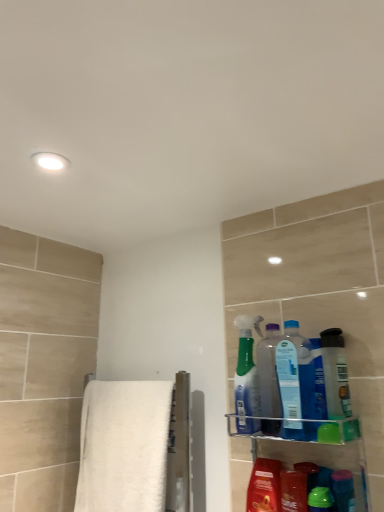
Question: Can you confirm if translucent green spray bottle at upper right, the fifth cleaning product viewed from the right, is bigger than translucent plastic spray bottle at upper right, acting as the 5th cleaning product starting from the left?

Choices:
 (A) yes
 (B) no

Answer: (A)

Question: Would you say translucent green spray bottle at upper right, the fifth cleaning product viewed from the right, is a long distance from translucent plastic spray bottle at upper right, positioned as the first cleaning product in right-to-left order?

Choices:
 (A) yes
 (B) no

Answer: (B)

Question: From the image's perspective, does translucent green spray bottle at upper right, the fifth cleaning product viewed from the right, appear lower than translucent plastic spray bottle at upper right, acting as the 5th cleaning product starting from the left?

Choices:
 (A) yes
 (B) no

Answer: (A)

Question: Would you say translucent green spray bottle at upper right, the 1th cleaning product viewed from the left, is outside translucent plastic spray bottle at upper right, acting as the 5th cleaning product starting from the left?

Choices:
 (A) no
 (B) yes

Answer: (B)

Question: From a real-world perspective, is translucent green spray bottle at upper right, the fifth cleaning product viewed from the right, beneath translucent plastic spray bottle at upper right, acting as the 5th cleaning product starting from the left?

Choices:
 (A) no
 (B) yes

Answer: (A)

Question: Does translucent green spray bottle at upper right, the 1th cleaning product viewed from the left, have a lesser width compared to translucent plastic spray bottle at upper right, acting as the 5th cleaning product starting from the left?

Choices:
 (A) yes
 (B) no

Answer: (B)

Question: Is shiny plastic mouthwash at lower right placed right next to clear plastic shelf at lower right?

Choices:
 (A) no
 (B) yes

Answer: (B)

Question: From a real-world perspective, is shiny plastic mouthwash at lower right on clear plastic shelf at lower right?

Choices:
 (A) yes
 (B) no

Answer: (B)

Question: Is shiny plastic mouthwash at lower right facing away from clear plastic shelf at lower right?

Choices:
 (A) no
 (B) yes

Answer: (B)

Question: Is shiny plastic mouthwash at lower right at the right side of clear plastic shelf at lower right?

Choices:
 (A) no
 (B) yes

Answer: (A)

Question: Can you confirm if shiny plastic mouthwash at lower right is smaller than clear plastic shelf at lower right?

Choices:
 (A) no
 (B) yes

Answer: (B)

Question: From the image's perspective, is shiny plastic mouthwash at lower right beneath clear plastic shelf at lower right?

Choices:
 (A) no
 (B) yes

Answer: (B)

Question: Is translucent plastic bottle at right bigger than shiny plastic mouthwash at lower right?

Choices:
 (A) no
 (B) yes

Answer: (A)